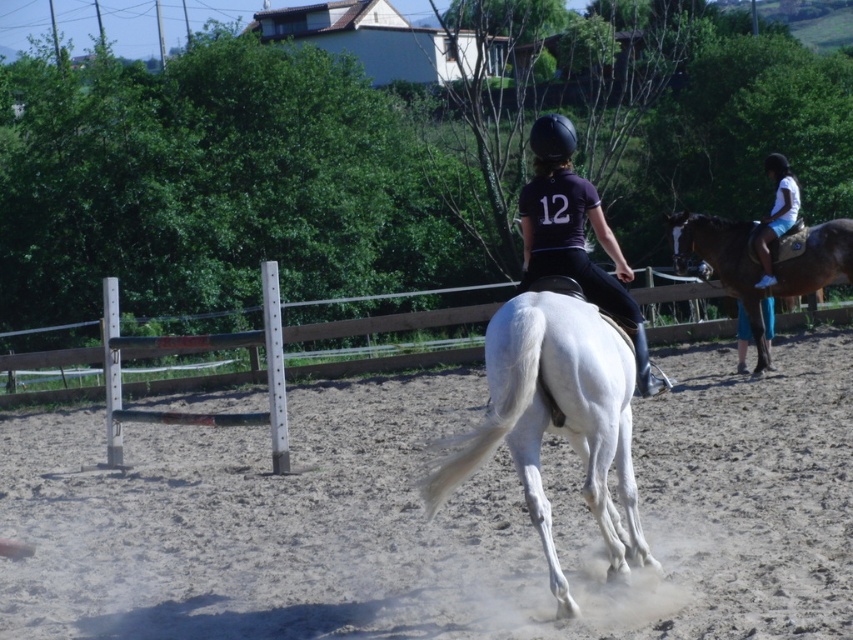
You are a photographer positioned at the edge of the arena. You want to capture a photo where both the white glossy horse at center and the matte black jockey at center are clearly visible. Given their sizes, which one might appear larger in the photo?

The matte black jockey at center appears larger in the photo because the white glossy horse at center is smaller than the matte black jockey at center.

You are a photographer positioned at the edge of the arena. You want to capture a photo where the dusty sand at center is visible in front of the matte black jockey at center. Is this possible given their current positions?

Yes, the dusty sand at center is already positioned in front of the matte black jockey at center, so capturing such a photo is possible.

You are a photographer standing at the camera position. You want to capture a closeup shot of the matte black jockey at center. Considering your current distance, is it feasible to do so without moving closer?

The matte black jockey at center is 7.41 meters away from the camera. Depending on the lens capabilities of your camera, it might be possible to capture a closeup shot without moving closer by using a telephoto lens to zoom in.